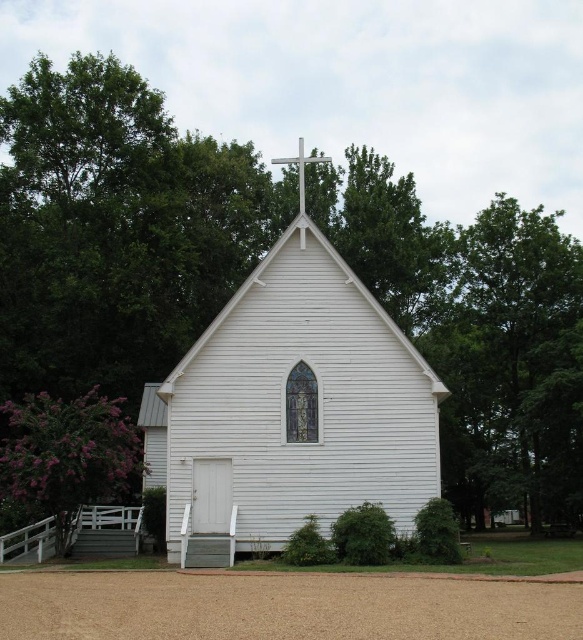
Between white wood chapel at center and metallic cross at center, which one appears on the left side from the viewer's perspective?

Positioned to the left is white wood chapel at center.

Does white wood chapel at center have a greater width compared to metallic cross at center?

Correct, the width of white wood chapel at center exceeds that of metallic cross at center.

Locate an element on the screen. white wood chapel at center is located at coordinates (290, 410).